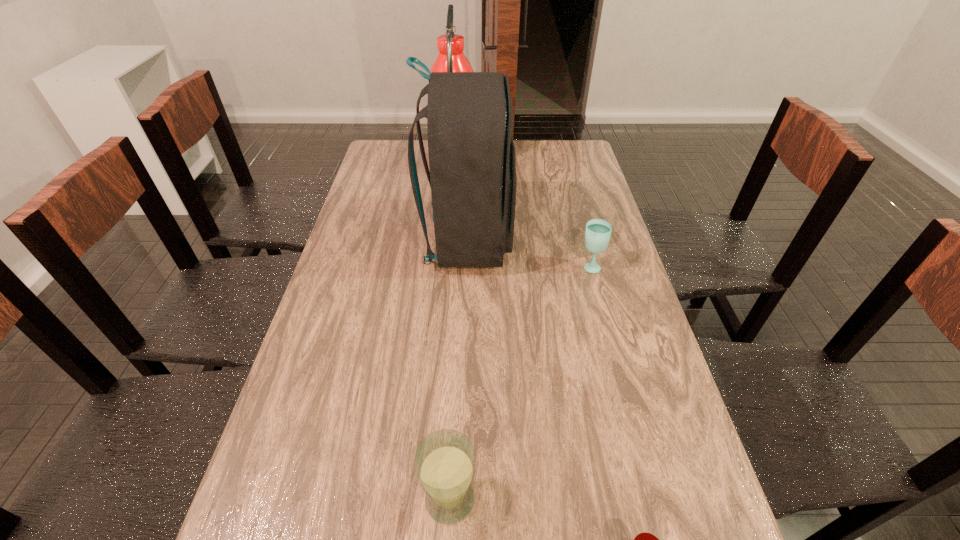
Locate an element on the screen. Image resolution: width=960 pixels, height=540 pixels. blank space that satisfies the following two spatial constraints: 1. on the label side of the farthest object; 2. on the left side of the second tallest glass is located at coordinates (447, 266).

This screenshot has width=960, height=540. Find the location of `vacant area that satisfies the following two spatial constraints: 1. on the label side of the farthest object; 2. on the right side of the rightmost glass`. vacant area that satisfies the following two spatial constraints: 1. on the label side of the farthest object; 2. on the right side of the rightmost glass is located at coordinates (447, 266).